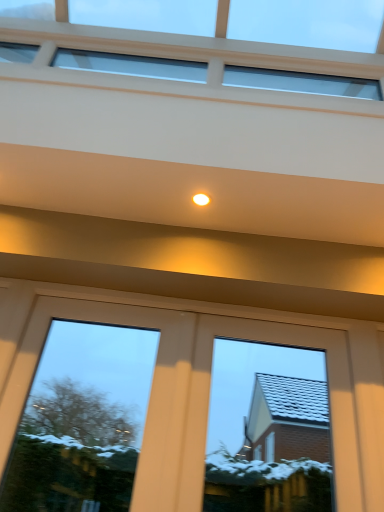
Measure the distance between white glossy door at center and camera.

white glossy door at center and camera are 1.45 meters apart.

The image size is (384, 512). I want to click on white glossy door at center, so click(180, 391).

This screenshot has height=512, width=384. What do you see at coordinates (180, 391) in the screenshot? I see `white glossy door at center` at bounding box center [180, 391].

Where is `white glossy door at center`? white glossy door at center is located at coordinates (180, 391).